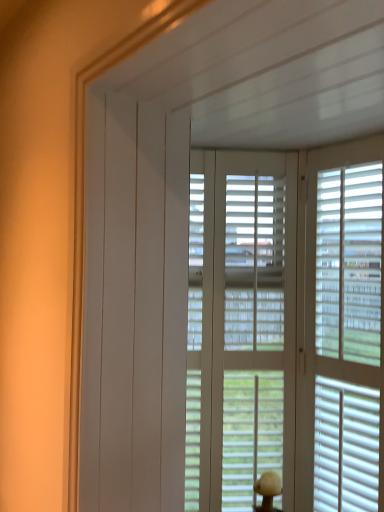
Question: From a real-world perspective, is white matte window blind at center above or below white matte blinds at right?

Choices:
 (A) below
 (B) above

Answer: (A)

Question: From the image's perspective, is white matte window blind at center positioned above or below white matte blinds at right?

Choices:
 (A) below
 (B) above

Answer: (A)

Question: Visually, is white matte window blind at center positioned to the left or to the right of white matte blinds at right?

Choices:
 (A) left
 (B) right

Answer: (A)

Question: Considering their positions, is white matte blinds at right located in front of or behind white matte window blind at center?

Choices:
 (A) behind
 (B) front

Answer: (B)

Question: From the image's perspective, is white matte blinds at right positioned above or below white matte window blind at center?

Choices:
 (A) above
 (B) below

Answer: (A)

Question: Is point (339, 292) closer or farther from the camera than point (380, 220)?

Choices:
 (A) farther
 (B) closer

Answer: (A)

Question: In terms of size, does white matte blinds at right appear bigger or smaller than white matte window blind at center?

Choices:
 (A) small
 (B) big

Answer: (A)